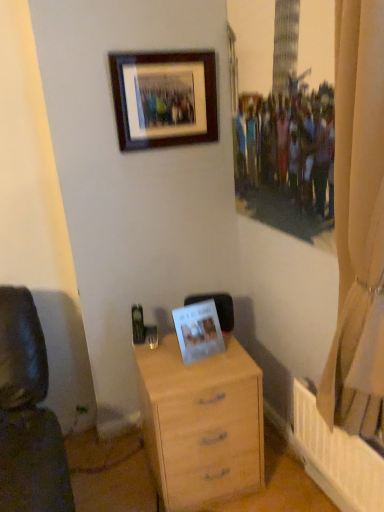
This screenshot has height=512, width=384. Identify the location of empty space that is ontop of light wood chest of drawers at center (from a real-world perspective). (173, 361).